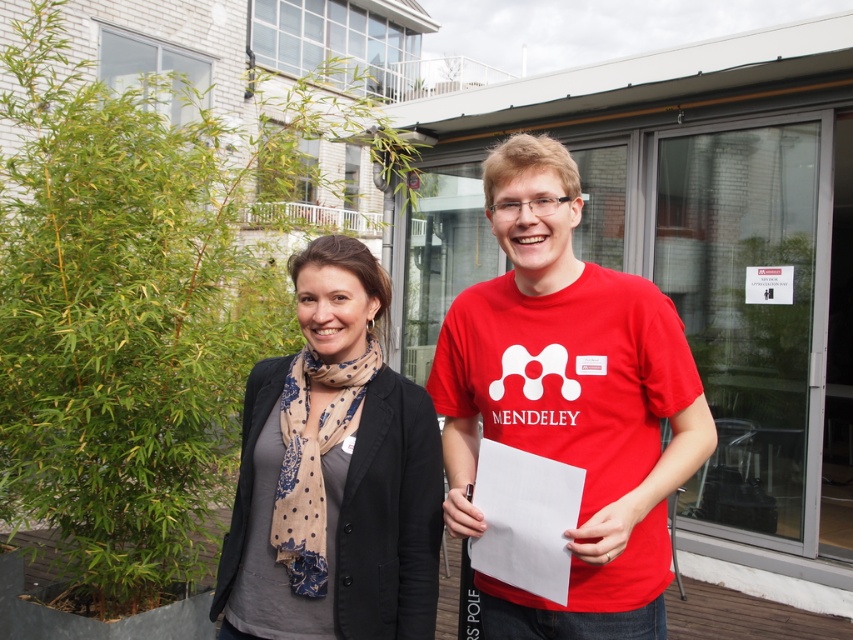
You are taking a photo of two people standing on a patio. The first person is at point (527, 442) and the second person is at point (254, 376). Which person is closer to the camera?

The person at point (527, 442) is closer to the camera than the person at point (254, 376).